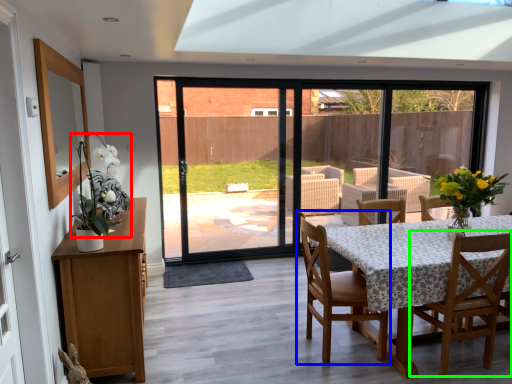
Question: Which object is positioned closest to floral arrangement (highlighted by a red box)? Select from chair (highlighted by a blue box) and chair (highlighted by a green box).

Choices:
 (A) chair
 (B) chair

Answer: (A)